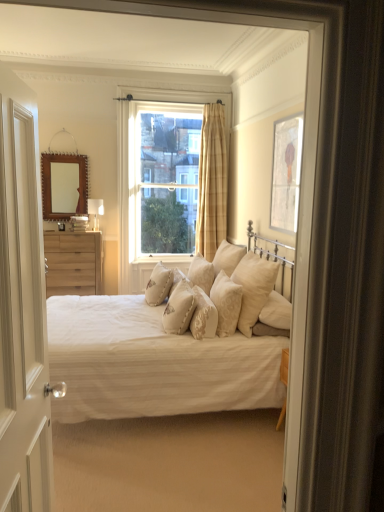
Question: Can you confirm if clear glass window at center is shorter than beige fabric pillow at center, which is the seventh pillow from left to right?

Choices:
 (A) no
 (B) yes

Answer: (A)

Question: From the image's perspective, is clear glass window at center on beige fabric pillow at center, placed as the first pillow when sorted from right to left?

Choices:
 (A) no
 (B) yes

Answer: (B)

Question: Does clear glass window at center come behind beige fabric pillow at center, placed as the first pillow when sorted from right to left?

Choices:
 (A) yes
 (B) no

Answer: (A)

Question: Considering the relative sizes of clear glass window at center and beige fabric pillow at center, which is the seventh pillow from left to right, in the image provided, is clear glass window at center wider than beige fabric pillow at center, which is the seventh pillow from left to right,?

Choices:
 (A) no
 (B) yes

Answer: (A)

Question: Would you say clear glass window at center contains beige fabric pillow at center, placed as the first pillow when sorted from right to left?

Choices:
 (A) yes
 (B) no

Answer: (B)

Question: From the image's perspective, is beige textured pillow at center, which is the 6th pillow from right to left, positioned above or below matte silver picture frame at upper right?

Choices:
 (A) below
 (B) above

Answer: (A)

Question: From a real-world perspective, is beige textured pillow at center, which is the 6th pillow from right to left, positioned above or below matte silver picture frame at upper right?

Choices:
 (A) above
 (B) below

Answer: (B)

Question: Would you say beige textured pillow at center, which is the 6th pillow from right to left, is inside or outside matte silver picture frame at upper right?

Choices:
 (A) outside
 (B) inside

Answer: (A)

Question: Looking at the image, does beige textured pillow at center, marked as the second pillow in a left-to-right arrangement, seem bigger or smaller compared to matte silver picture frame at upper right?

Choices:
 (A) small
 (B) big

Answer: (A)

Question: Would you say natural wood chest of drawers at left is to the left or to the right of beige textured pillow at center, which is the 6th pillow from right to left, in the picture?

Choices:
 (A) left
 (B) right

Answer: (A)

Question: From a real-world perspective, relative to beige textured pillow at center, which is the 6th pillow from right to left, is natural wood chest of drawers at left vertically above or below?

Choices:
 (A) above
 (B) below

Answer: (A)

Question: In terms of width, does natural wood chest of drawers at left look wider or thinner when compared to beige textured pillow at center, which is the 6th pillow from right to left?

Choices:
 (A) wide
 (B) thin

Answer: (A)

Question: Looking at the image, does natural wood chest of drawers at left seem bigger or smaller compared to beige textured pillow at center, marked as the second pillow in a left-to-right arrangement?

Choices:
 (A) big
 (B) small

Answer: (A)

Question: Is plaid fabric curtain at center taller or shorter than matte silver picture frame at upper right?

Choices:
 (A) tall
 (B) short

Answer: (A)

Question: Is plaid fabric curtain at center bigger or smaller than matte silver picture frame at upper right?

Choices:
 (A) big
 (B) small

Answer: (A)